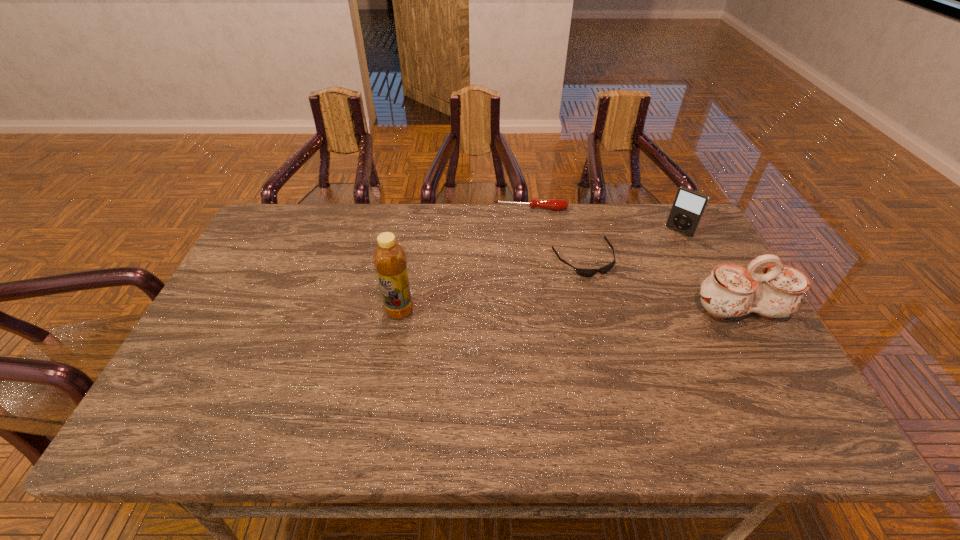
The width and height of the screenshot is (960, 540). In order to click on vacant space at the far left corner of the desktop in this screenshot , I will do `click(271, 233)`.

In the image, there is a desktop. Where is `vacant area at the far right corner`? Image resolution: width=960 pixels, height=540 pixels. vacant area at the far right corner is located at coordinates (700, 227).

At what (x,y) coordinates should I click in order to perform the action: click on vacant point located between the chinaware and the second farthest object. Please return your answer as a coordinate pair (x, y). The width and height of the screenshot is (960, 540). Looking at the image, I should click on (709, 271).

The image size is (960, 540). I want to click on vacant space that's between the third tallest object and the chinaware, so click(x=709, y=271).

Locate an element on the screen. Image resolution: width=960 pixels, height=540 pixels. vacant region between the iPod and the leftmost object is located at coordinates (540, 271).

Locate an element on the screen. This screenshot has height=540, width=960. free space between the bottle and the fourth shortest object is located at coordinates (x=570, y=310).

You are a GUI agent. You are given a task and a screenshot of the screen. Output one action in this format:
    pyautogui.click(x=<x>, y=<y>)
    Task: Click on the vacant space that is in between the third nearest object and the fourth tallest object
    The image size is (960, 540).
    Given the screenshot: What is the action you would take?
    pyautogui.click(x=557, y=234)

I want to click on free point between the third farthest object and the fourth nearest object, so click(631, 246).

At what (x,y) coordinates should I click in order to perform the action: click on free spot between the farthest object and the sunglasses. Please return your answer as a coordinate pair (x, y). This screenshot has width=960, height=540. Looking at the image, I should click on (557, 234).

Locate an element on the screen. Image resolution: width=960 pixels, height=540 pixels. vacant space that's between the fourth shortest object and the farthest object is located at coordinates (636, 260).